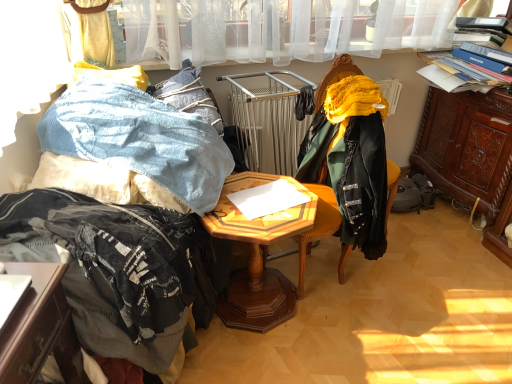
Locate an element on the screen. The image size is (512, 384). free space on the front side of woodenobject at center is located at coordinates (268, 360).